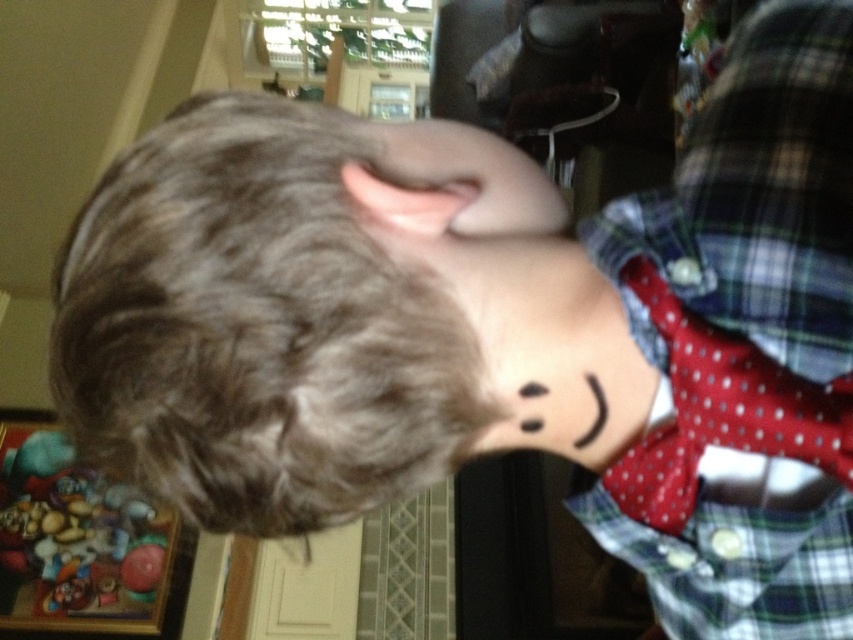
You are an interior designer assessing the layout of this room. Given the brown matte hair at center and the plaid fabric shirt at right, which object occupies a larger horizontal space in the scene?

The brown matte hair at center has a greater width than the plaid fabric shirt at right, so it occupies a larger horizontal space in the scene.

You are a tailor measuring a person for a custom shirt. You need to determine if the plaid fabric shirt at right can be adjusted to fit over the black matte neck at center. Based on their sizes, is this possible?

The plaid fabric shirt at right is much taller than the black matte neck at center, so it can be adjusted to fit over the black matte neck at center.

In the scene shown: You are a photographer adjusting your camera to focus on the brown matte hair at center and the black matte neck at center. Which object should you focus on first if you want to ensure both are in focus?

You should focus on the brown matte hair at center first because it is closer to the viewer than the black matte neck at center, so adjusting focus from near to far will help both be in focus.